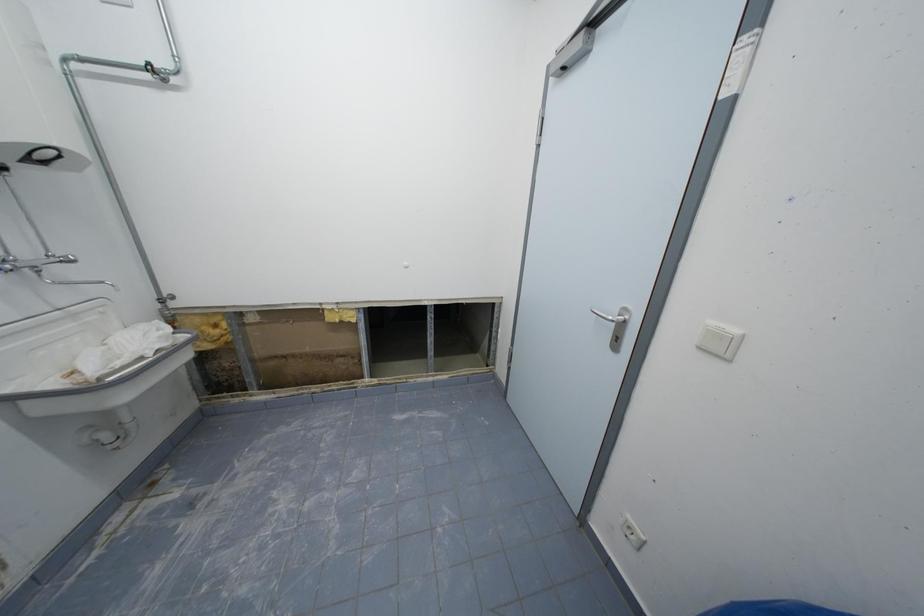
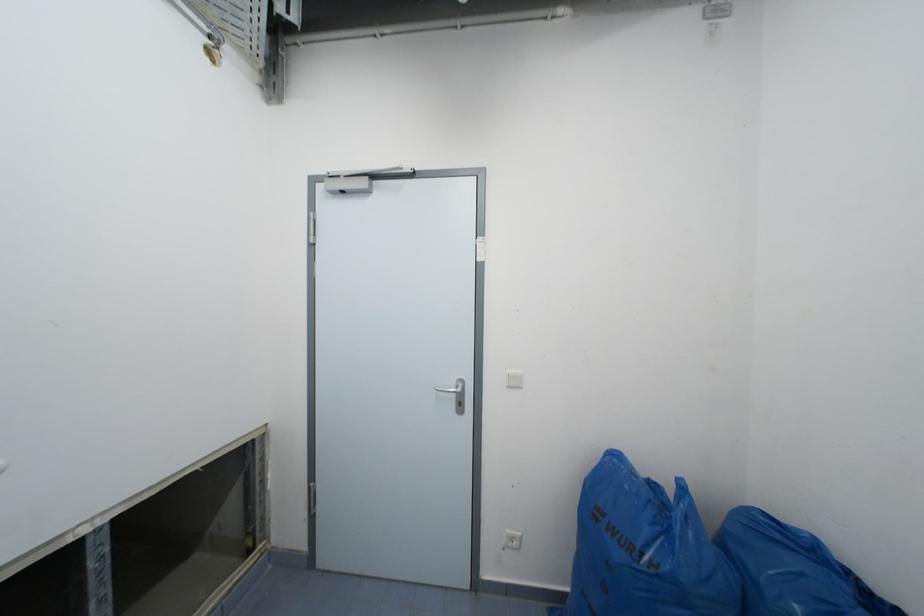
Question: The first image is from the beginning of the video and the second image is from the end. How did the camera likely rotate when shooting the video?

Choices:
 (A) Left
 (B) Right
 (C) Up
 (D) Down

Answer: (B)